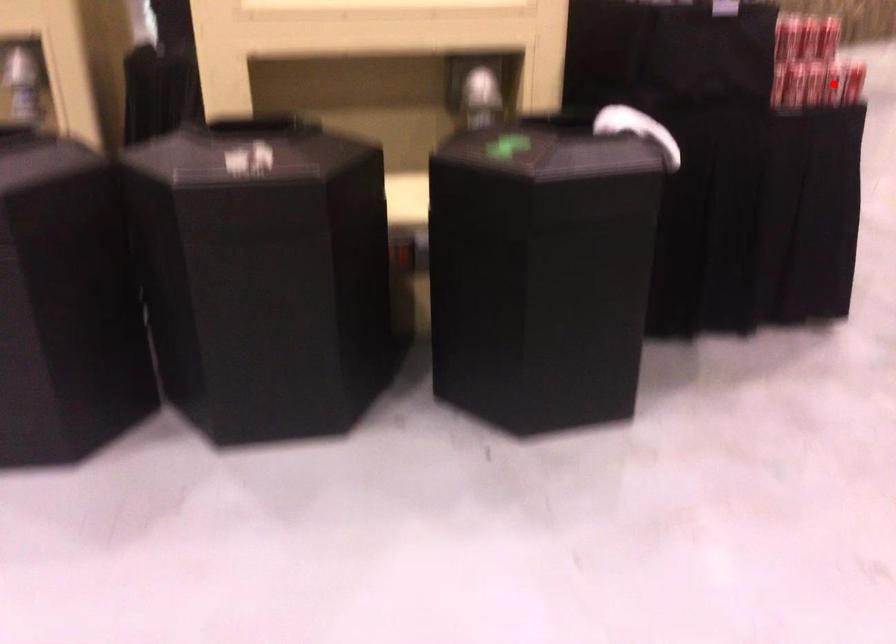
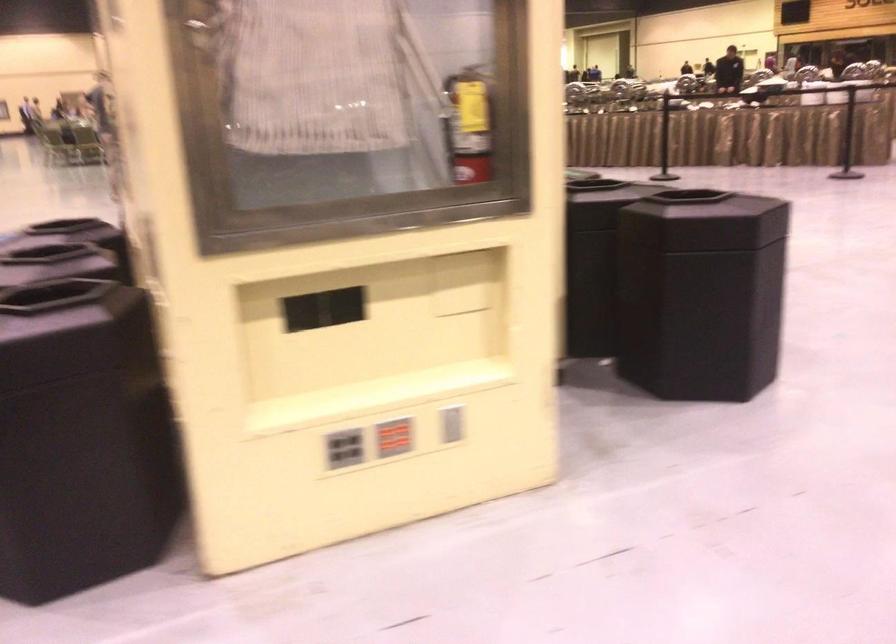
Question: I am providing you with two images of the same scene from different viewpoints. A red point is marked on the first image. At the location where the point appears in image 1, is it still visible in image 2?

Choices:
 (A) Yes
 (B) No

Answer: (B)